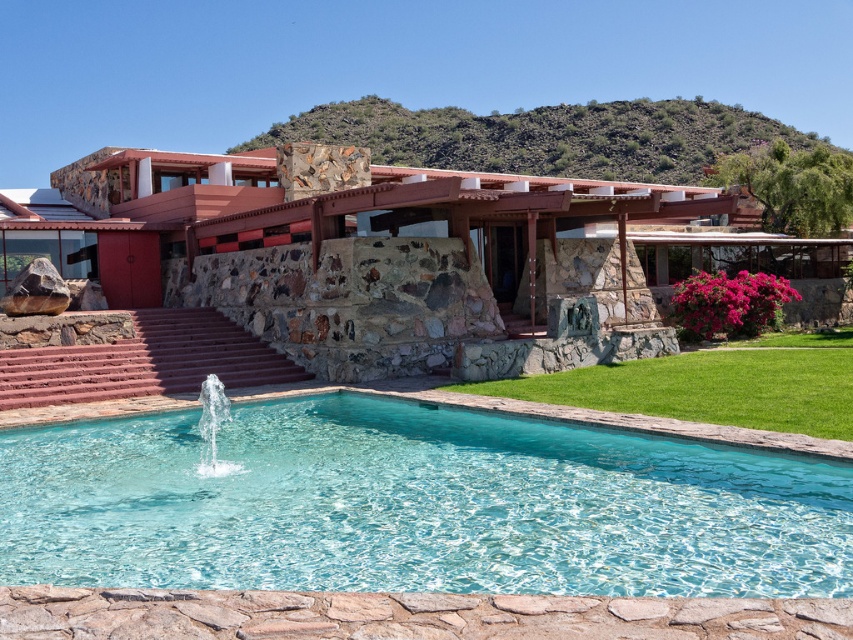
Question: Which object is the farthest from the rustic stone villa at center?

Choices:
 (A) clear glass pool at center
 (B) green grass at lower center

Answer: (A)

Question: Which of the following is the closest to the observer?

Choices:
 (A) (202, 452)
 (B) (123, 532)

Answer: (B)

Question: Where is clear glass pool at center located in relation to rustic stone villa at center in the image?

Choices:
 (A) below
 (B) above

Answer: (A)

Question: Which point is closer to the camera?

Choices:
 (A) coord(531,388)
 (B) coord(207,442)
 (C) coord(473,266)

Answer: (B)

Question: Does green grass at lower center have a lesser width compared to clear glass water at center?

Choices:
 (A) no
 (B) yes

Answer: (A)

Question: Does green grass at lower center have a greater width compared to clear glass water at center?

Choices:
 (A) yes
 (B) no

Answer: (A)